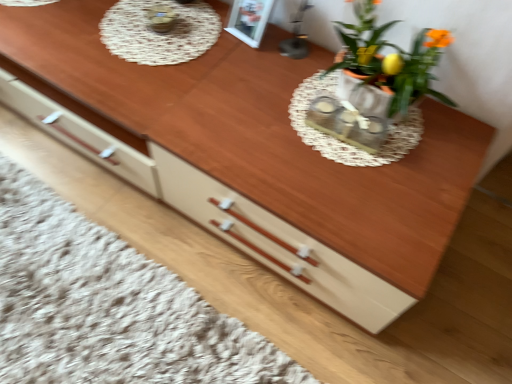
The image size is (512, 384). Identify the location of white lace doily at upper center. (159, 31).

What do you see at coordinates (390, 58) in the screenshot? The height and width of the screenshot is (384, 512). I see `matte orange pot at upper right` at bounding box center [390, 58].

The image size is (512, 384). Identify the location of white lace doily at upper center. (159, 31).

Is matte white flowerpot at upper right to the right of white lace doily at upper center from the viewer's perspective?

Yes, matte white flowerpot at upper right is to the right of white lace doily at upper center.

Which is behind, point (387, 111) or point (162, 63)?

The point (162, 63) is farther from the camera.

Between matte white flowerpot at upper right and white lace doily at upper center, which one has less height?

white lace doily at upper center is shorter.

Could you tell me if matte white flowerpot at upper right is facing white lace doily at upper center?

No, matte white flowerpot at upper right is not turned towards white lace doily at upper center.

Measure the distance from matte white flowerpot at upper right to matte orange pot at upper right.

matte white flowerpot at upper right and matte orange pot at upper right are 3.09 inches apart.

Does matte white flowerpot at upper right have a larger size compared to matte orange pot at upper right?

Incorrect, matte white flowerpot at upper right is not larger than matte orange pot at upper right.

Does matte white flowerpot at upper right turn towards matte orange pot at upper right?

Yes.

From a real-world perspective, does matte white flowerpot at upper right sit lower than matte orange pot at upper right?

Yes, from a real-world perspective, matte white flowerpot at upper right is below matte orange pot at upper right.

Is matte orange pot at upper right located outside matte white flowerpot at upper right?

That's correct, matte orange pot at upper right is outside of matte white flowerpot at upper right.

Between matte orange pot at upper right and matte white flowerpot at upper right, which one has larger size?

With larger size is matte orange pot at upper right.

From the image's perspective, is matte orange pot at upper right located above or below matte white flowerpot at upper right?

Based on their image positions, matte orange pot at upper right is located above matte white flowerpot at upper right.

Identify the location of flowerpot located behind the matte orange pot at upper right. The image size is (512, 384). (365, 96).

Is white lace doily at upper center to the left or to the right of matte white flowerpot at upper right in the image?

Based on their positions, white lace doily at upper center is located to the left of matte white flowerpot at upper right.

Could matte white flowerpot at upper right be considered to be inside white lace doily at upper center?

No.

Is white lace doily at upper center beside matte white flowerpot at upper right?

white lace doily at upper center and matte white flowerpot at upper right are not in contact.

Between point (164, 64) and point (347, 81), which one is positioned behind?

The point (164, 64) is behind.

Where is `round table below the matte orange pot at upper right (from a real-world perspective)`? This screenshot has width=512, height=384. round table below the matte orange pot at upper right (from a real-world perspective) is located at coordinates (159, 31).

Is white lace doily at upper center at the right side of matte orange pot at upper right?

Incorrect, white lace doily at upper center is not on the right side of matte orange pot at upper right.

Is white lace doily at upper center completely or partially outside of matte orange pot at upper right?

Yes, white lace doily at upper center is outside of matte orange pot at upper right.

Does white lace doily at upper center touch matte orange pot at upper right?

No, white lace doily at upper center is not making contact with matte orange pot at upper right.

Is matte orange pot at upper right in front of white lace doily at upper center?

Yes, matte orange pot at upper right is closer to the camera.

Does matte orange pot at upper right appear on the right side of white lace doily at upper center?

Yes, matte orange pot at upper right is to the right of white lace doily at upper center.

Is matte orange pot at upper right next to white lace doily at upper center and touching it?

matte orange pot at upper right and white lace doily at upper center are clearly separated.

Is matte orange pot at upper right not inside white lace doily at upper center?

Yes.

Identify the location of round table that appears behind the matte white flowerpot at upper right. The image size is (512, 384). (159, 31).

Locate an element on the screen. Image resolution: width=512 pixels, height=384 pixels. houseplant above the matte white flowerpot at upper right (from a real-world perspective) is located at coordinates (390, 58).

Looking at the image, which one is located closer to white lace doily at upper center, matte orange pot at upper right or matte white flowerpot at upper right?

matte orange pot at upper right is positioned closer to the anchor white lace doily at upper center.

Looking at the image, which one is located further to matte orange pot at upper right, matte white flowerpot at upper right or white lace doily at upper center?

Among the two, white lace doily at upper center is located further to matte orange pot at upper right.

Based on their spatial positions, is white lace doily at upper center or matte white flowerpot at upper right closer to matte orange pot at upper right?

The object closer to matte orange pot at upper right is matte white flowerpot at upper right.

Looking at this image, looking at the image, which one is located further to white lace doily at upper center, matte white flowerpot at upper right or matte orange pot at upper right?

The object further to white lace doily at upper center is matte white flowerpot at upper right.

Considering their positions, is matte orange pot at upper right positioned closer to matte white flowerpot at upper right than white lace doily at upper center?

Among the two, matte orange pot at upper right is located nearer to matte white flowerpot at upper right.

Looking at the image, which one is located further to matte white flowerpot at upper right, white lace doily at upper center or matte orange pot at upper right?

Among the two, white lace doily at upper center is located further to matte white flowerpot at upper right.

I want to click on houseplant between white lace doily at upper center and matte white flowerpot at upper right from left to right, so click(390, 58).